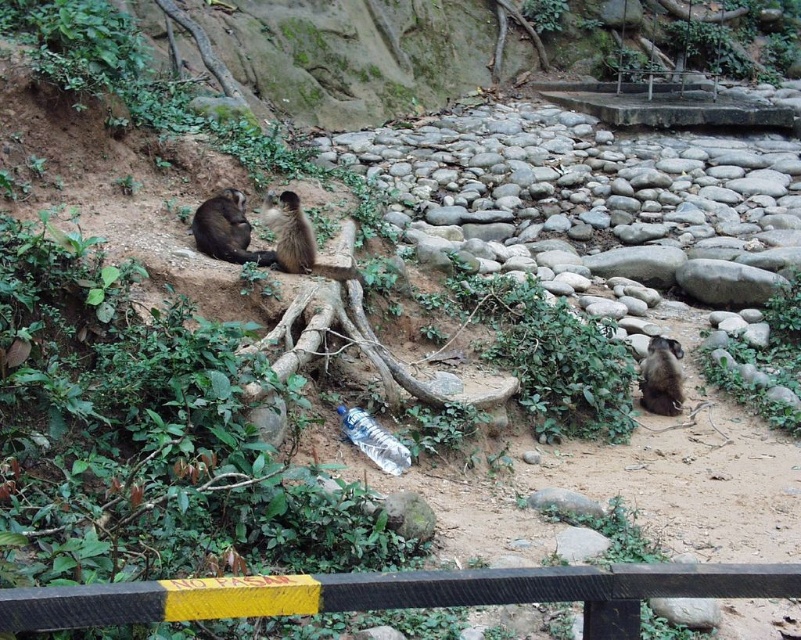
Is brown fur monkey at center behind fuzzy brown monkey at center?

That is False.

Which is below, brown fur monkey at center or fuzzy brown monkey at center?

brown fur monkey at center

Is point (220, 243) in front of point (312, 253)?

Yes, point (220, 243) is closer to viewer.

This screenshot has height=640, width=801. I want to click on brown fur monkey at center, so click(226, 228).

Does fuzzy brown monkey at center have a larger size compared to fuzzy brown monkey at lower right?

Correct, fuzzy brown monkey at center is larger in size than fuzzy brown monkey at lower right.

In the scene shown: Who is positioned more to the right, fuzzy brown monkey at center or fuzzy brown monkey at lower right?

fuzzy brown monkey at lower right

Which is in front, point (278, 250) or point (658, 403)?

Positioned in front is point (278, 250).

Where is `fuzzy brown monkey at center`? fuzzy brown monkey at center is located at coordinates (288, 232).

Is point (216, 240) more distant than point (353, 413)?

Yes, point (216, 240) is farther from viewer.

Identify the location of brown fur monkey at center. (226, 228).

The width and height of the screenshot is (801, 640). I want to click on brown fur monkey at center, so click(x=226, y=228).